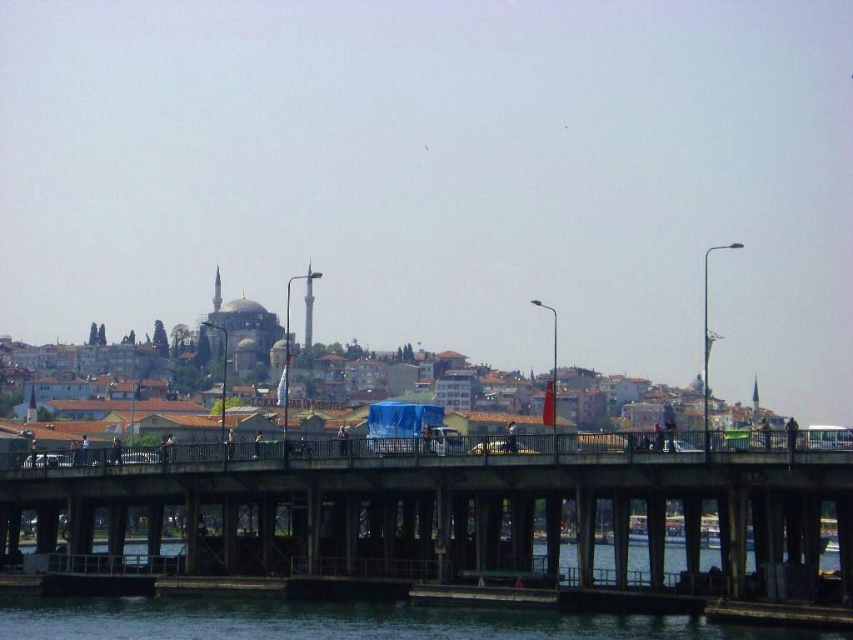
Question: Does concrete bridge at center have a larger size compared to transparent water at lower center?

Choices:
 (A) yes
 (B) no

Answer: (A)

Question: Which object is closer to the camera taking this photo?

Choices:
 (A) transparent water at lower center
 (B) concrete bridge at center

Answer: (A)

Question: Which point is farther to the camera?

Choices:
 (A) (779, 502)
 (B) (486, 625)

Answer: (B)

Question: Is concrete bridge at center positioned at the back of transparent water at lower center?

Choices:
 (A) no
 (B) yes

Answer: (B)

Question: Where is concrete bridge at center located in relation to transparent water at lower center in the image?

Choices:
 (A) below
 (B) above

Answer: (A)